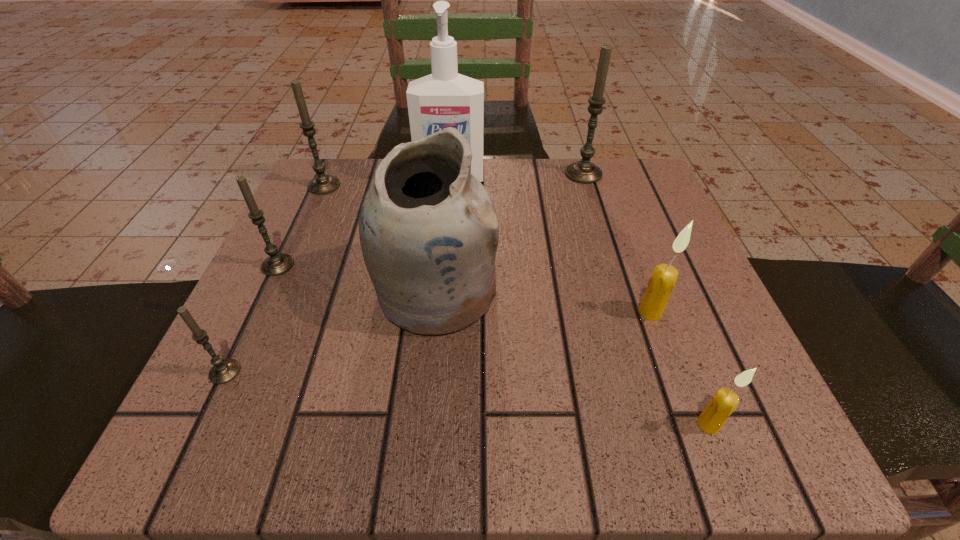
Image resolution: width=960 pixels, height=540 pixels. Find the location of `cleansing agent`. cleansing agent is located at coordinates (443, 99).

Identify the location of the tallest candle. (584, 171).

Identify the location of the rightmost gray candle. This screenshot has width=960, height=540. (584, 171).

In order to click on pottery in this screenshot , I will do `click(428, 231)`.

The width and height of the screenshot is (960, 540). I want to click on the fifth shortest candle, so click(x=322, y=184).

Identify the location of the fourth farthest candle. Image resolution: width=960 pixels, height=540 pixels. (663, 279).

Identify the location of the farther cream candle. This screenshot has height=540, width=960. (663, 279).

The image size is (960, 540). I want to click on the third farthest candle, so click(x=276, y=264).

Find the location of `the third farthest gray candle`. the third farthest gray candle is located at coordinates (276, 264).

Locate an element on the screen. the seventh farthest object is located at coordinates (224, 370).